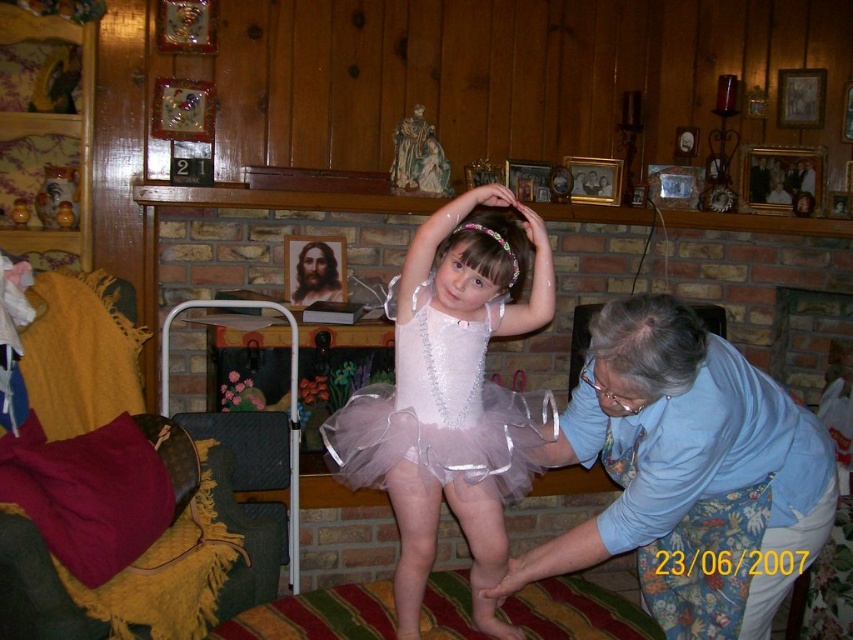
You are a photographer setting up a shoot in this room. You need to place a small prop exactly at the coordinates given for the blue floral apron at lower right. Where should you place it relative to the fireplace mantel?

The blue floral apron at lower right is located at point (689, 474), which is to the right and slightly above the fireplace mantel.

You are a photographer standing at the camera position. You need to take a closeup shot of the blue floral apron at lower right. Can you reach it with a 1.2 meter long extendable pole?

The blue floral apron at lower right is 1.31 meters away from the camera. The extendable pole is only 1.2 meters long, so it is not long enough to reach the blue floral apron at lower right.

You are organizing a childrens party and need to decide which item to place on the table. The blue floral apron at lower right and the pale pink tulle tutu at center are both available. Which item takes up more space?

The pale pink tulle tutu at center takes up more space because it is larger than the blue floral apron at lower right.